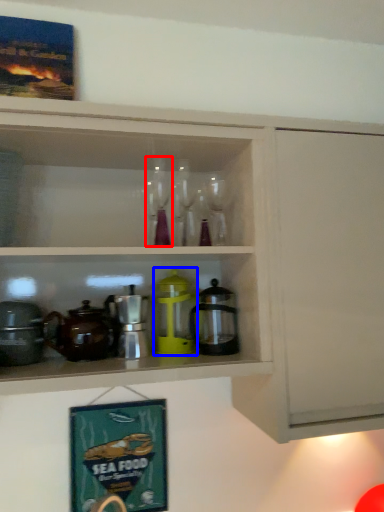
Question: Which point is closer to the camera, wine glass (highlighted by a red box) or appliance (highlighted by a blue box)?

Choices:
 (A) wine glass
 (B) appliance

Answer: (A)